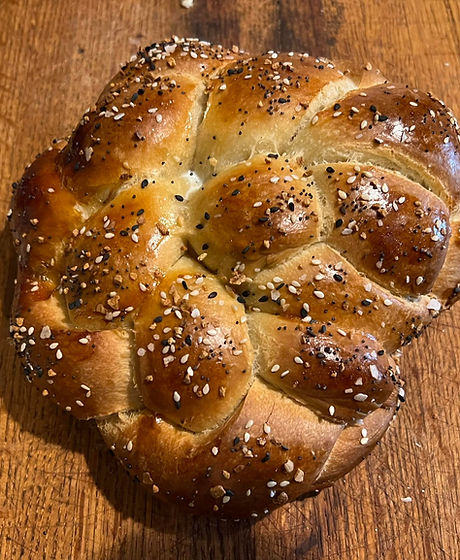
Identify the location of shadows on table, top center edge. The width and height of the screenshot is (460, 560). (311, 22), (222, 30).